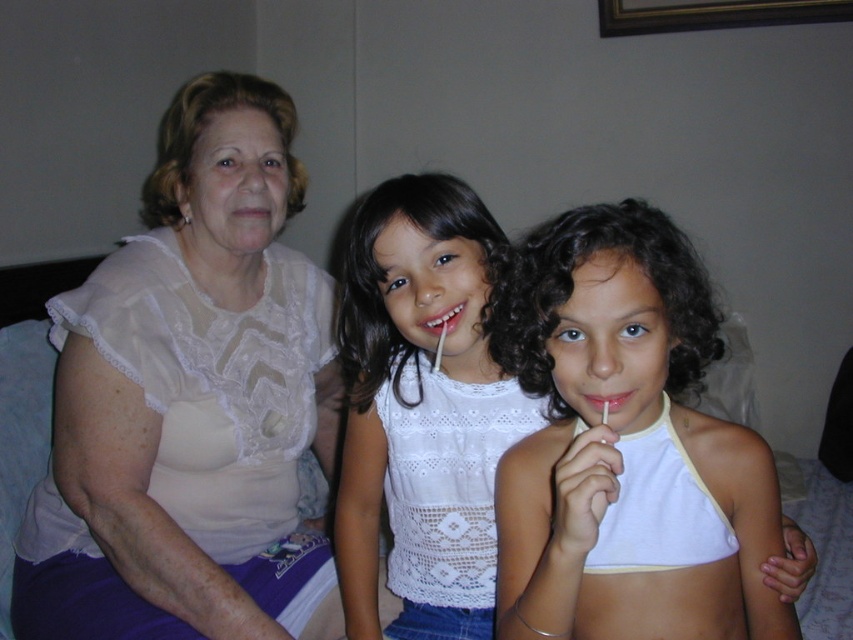
Based on the scene description, which clothing item is positioned more to the left between the white lace blouse at left and the white cotton halter top at center?

The white lace blouse at left is positioned more to the left than the white cotton halter top at center.